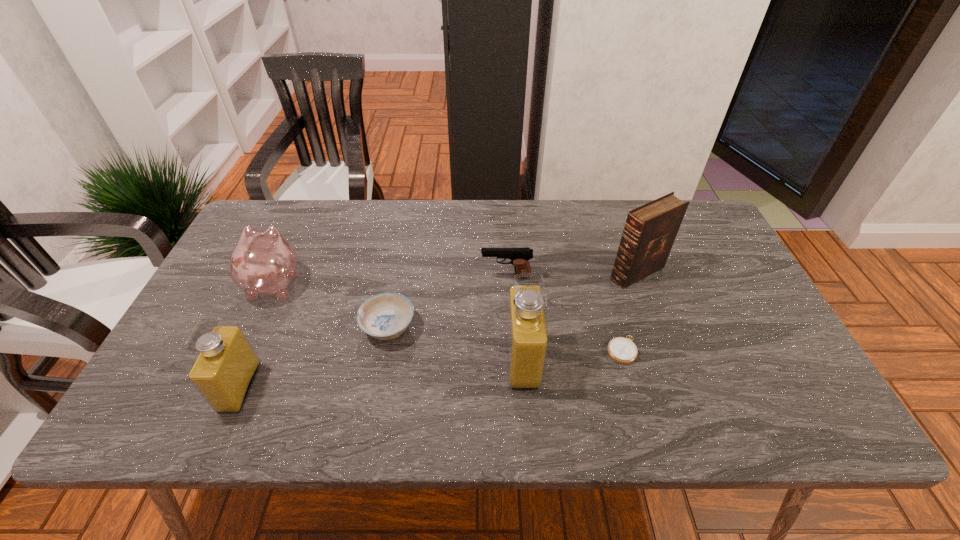
Image resolution: width=960 pixels, height=540 pixels. In order to click on free point between the Bible and the third shortest object in this screenshot , I will do `click(571, 275)`.

Find the location of a particular element. The width and height of the screenshot is (960, 540). blank region between the second shortest object and the left perfume is located at coordinates (314, 357).

This screenshot has height=540, width=960. In order to click on free spot between the shortest object and the third object from left to right in this screenshot , I will do `click(505, 339)`.

At what (x,y) coordinates should I click in order to perform the action: click on vacant space that's between the taller perfume and the shortest object. Please return your answer as a coordinate pair (x, y). Image resolution: width=960 pixels, height=540 pixels. Looking at the image, I should click on (572, 355).

Find the location of a particular element. This screenshot has width=960, height=540. blank region between the shorter perfume and the compass is located at coordinates (431, 368).

At what (x,y) coordinates should I click in order to perform the action: click on empty space between the Bible and the left perfume. Please return your answer as a coordinate pair (x, y). The image size is (960, 540). Looking at the image, I should click on (439, 330).

At what (x,y) coordinates should I click in order to perform the action: click on free space between the compass and the fourth tallest object. Please return your answer as a coordinate pair (x, y). This screenshot has width=960, height=540. Looking at the image, I should click on (448, 316).

In order to click on unoccupied position between the Bible and the compass in this screenshot , I will do `click(630, 312)`.

Where is `object that is the third closest to the right perfume`? Image resolution: width=960 pixels, height=540 pixels. object that is the third closest to the right perfume is located at coordinates (384, 316).

At what (x,y) coordinates should I click in order to perform the action: click on object that stands as the closest to the taller perfume. Please return your answer as a coordinate pair (x, y). This screenshot has width=960, height=540. Looking at the image, I should click on (622, 350).